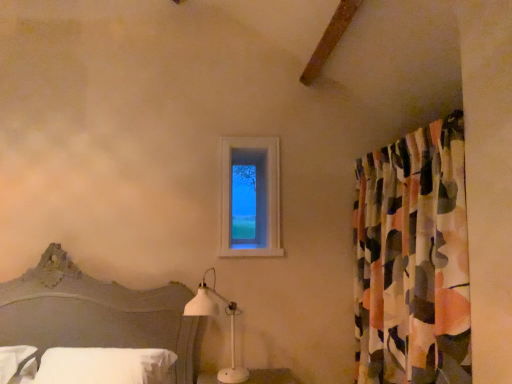
Question: Looking at the image, does clear glass window at upper center seem bigger or smaller compared to white soft pillow at lower left?

Choices:
 (A) big
 (B) small

Answer: (B)

Question: Is point (223, 157) positioned closer to the camera than point (154, 360)?

Choices:
 (A) closer
 (B) farther

Answer: (B)

Question: Estimate the real-world distances between objects in this image. Which object is farther from the clear glass window at upper center?

Choices:
 (A) white soft pillow at lower left
 (B) abstract fabric curtain at right
 (C) white matte table lamp at lower center
 (D) matte gray headboard at lower left

Answer: (A)

Question: Which of these objects is positioned closest to the matte gray headboard at lower left?

Choices:
 (A) white soft pillow at lower left
 (B) abstract fabric curtain at right
 (C) clear glass window at upper center
 (D) white matte table lamp at lower center

Answer: (A)